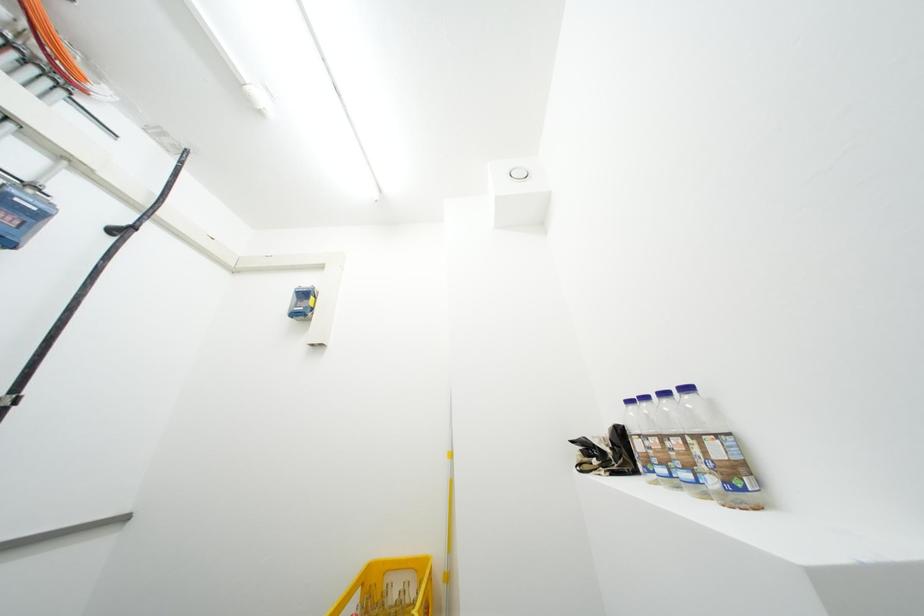
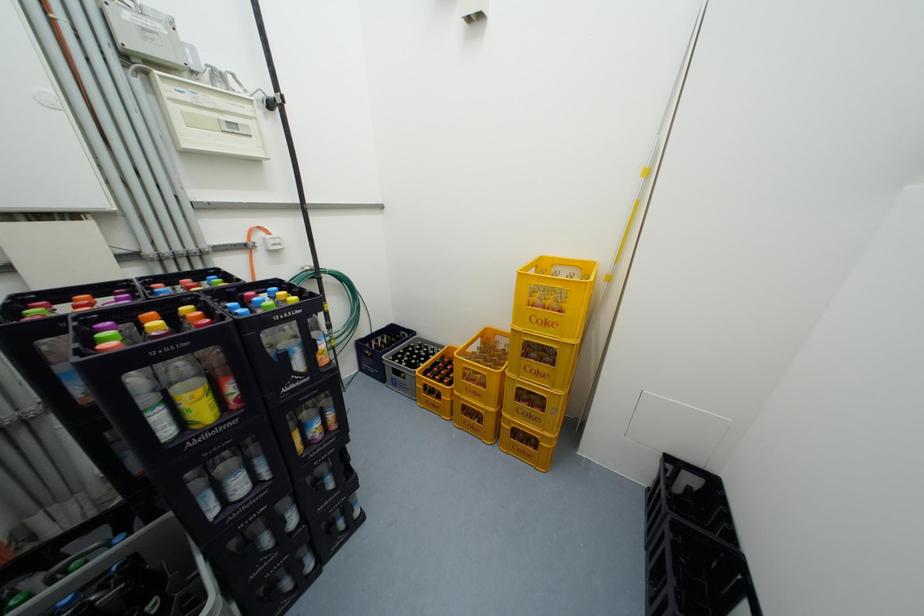
The images are taken continuously from a first-person perspective. In which direction is your viewpoint rotating?

The rotation direction of the camera is left-down.